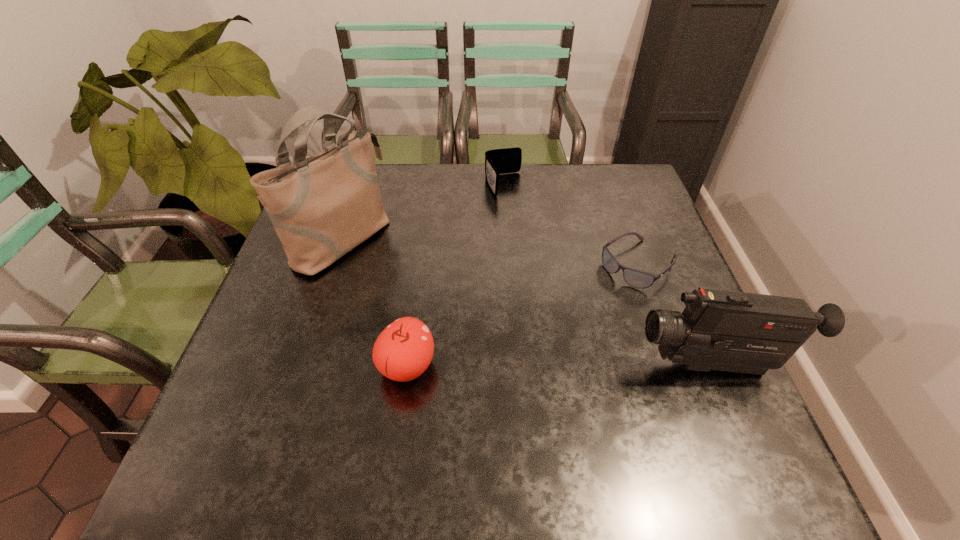
At what (x,y) coordinates should I click in order to perform the action: click on free point located 0.310m on the lenses of the sunglasses. Please return your answer as a coordinate pair (x, y). The width and height of the screenshot is (960, 540). Looking at the image, I should click on coord(530,356).

Where is `shoulder bag present at the far edge`? shoulder bag present at the far edge is located at coordinates point(323,206).

The image size is (960, 540). Find the location of `wallet at the far edge`. wallet at the far edge is located at coordinates (498, 161).

Where is `object that is at the near edge`? This screenshot has height=540, width=960. object that is at the near edge is located at coordinates (404, 349).

In order to click on object located at the left edge in this screenshot , I will do `click(323, 206)`.

This screenshot has width=960, height=540. In order to click on camcorder that is at the right edge in this screenshot , I will do `click(722, 330)`.

Identify the location of sunglasses positioned at the right edge. (637, 279).

What are the coordinates of `object located in the far left corner section of the desktop` in the screenshot? It's located at (323, 206).

The width and height of the screenshot is (960, 540). In the image, there is a desktop. Identify the location of vacant space at the far edge. (467, 208).

Image resolution: width=960 pixels, height=540 pixels. What are the coordinates of `vacant space at the near edge of the desktop` in the screenshot? It's located at (586, 389).